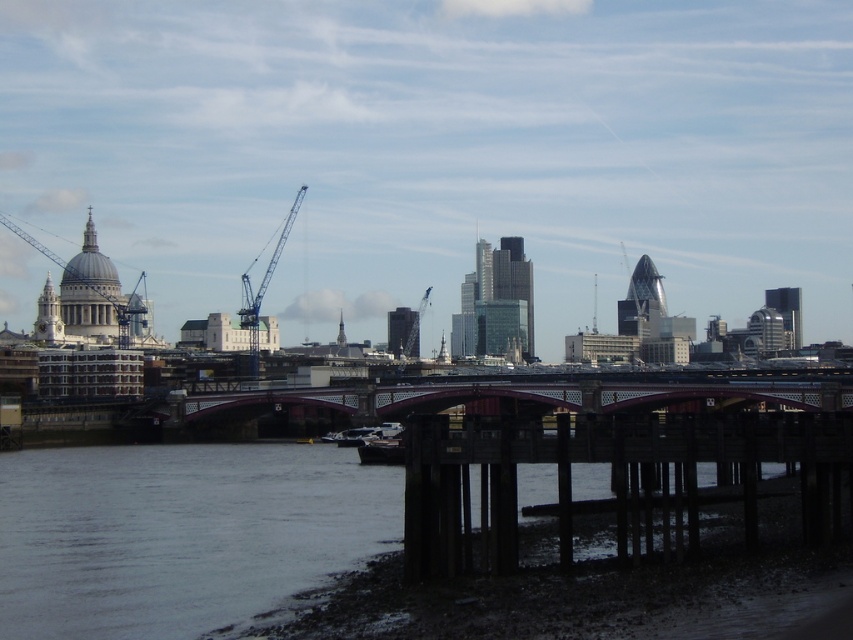
You are standing on the dark wood dock at lower right and want to walk to the metallic gray crane at center. Which direction should you move to reach it?

You should move backward because the dark wood dock at lower right is in front of the metallic gray crane at center, so the crane is behind the dock from your current position.

You are standing at the point with coordinates point (360, 442) and want to walk towards the point with coordinates point (614, 403). According to the image, is the destination point visible from your current position?

Point (614, 403) is behind point (360, 442), so the destination point is not visible from your current position.